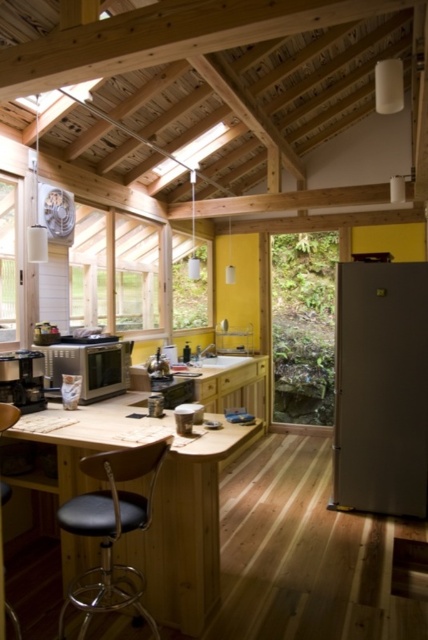
Question: Is satin silver refrigerator at right thinner than black matte coffee maker at lower left?

Choices:
 (A) yes
 (B) no

Answer: (B)

Question: Considering the relative positions of satin silver refrigerator at right and satin silver microwave at center in the image provided, where is satin silver refrigerator at right located with respect to satin silver microwave at center?

Choices:
 (A) left
 (B) right

Answer: (B)

Question: Which point is closer to the camera taking this photo?

Choices:
 (A) (51, 360)
 (B) (27, 355)
 (C) (142, 93)
 (D) (362, 326)

Answer: (B)

Question: Which object is positioned farthest from the black matte coffee maker at lower left?

Choices:
 (A) satin silver refrigerator at right
 (B) satin silver microwave at center

Answer: (A)

Question: Does wooden at upper center have a larger size compared to satin silver refrigerator at right?

Choices:
 (A) yes
 (B) no

Answer: (A)

Question: Which object is closer to the camera taking this photo?

Choices:
 (A) satin silver microwave at center
 (B) black matte coffee maker at lower left
 (C) black leather bar stool at center

Answer: (C)